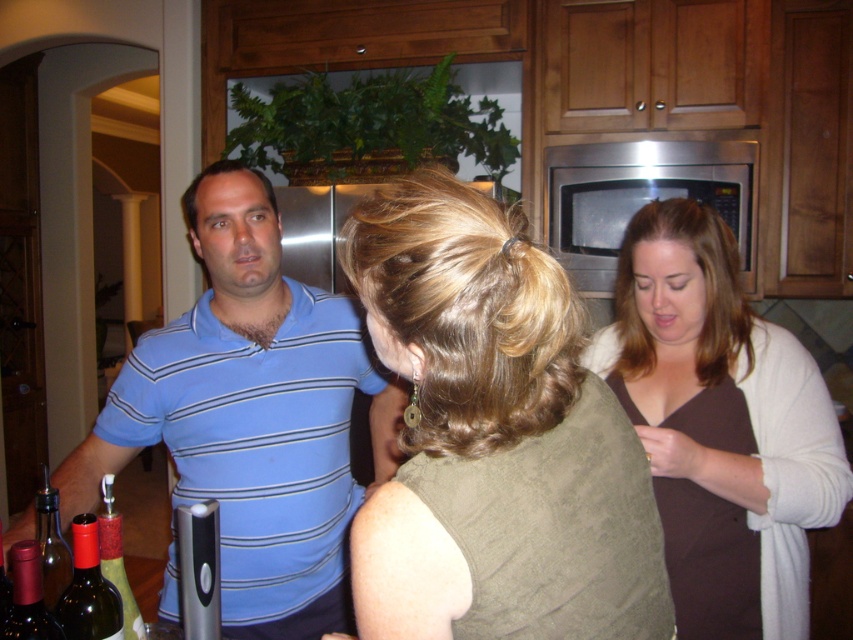
You are a bartender preparing drinks for a party. You need to place a matte red wine bottle at lower left on a shelf that is 30 inches wide. Can you fit it there?

The shelf is 30 inches wide, but the distance between the matte red wine bottle at lower left and the other objects is 35.64 inches, so it won not fit.

You are organizing a kitchen space and need to access the stainless steel microwave at upper center. There is a brown matte sweater at upper right in the way. Can you move the sweater to access the microwave?

The brown matte sweater at upper right is in front of the stainless steel microwave at upper center, so you can move the sweater to access the microwave.

In the kitchen scene, you notice the blue striped polo shirt at left and the matte red wine bottle at lower left. Which object takes up more space in the image?

The blue striped polo shirt at left takes up more space in the image as it has a larger size compared to the matte red wine bottle at lower left.